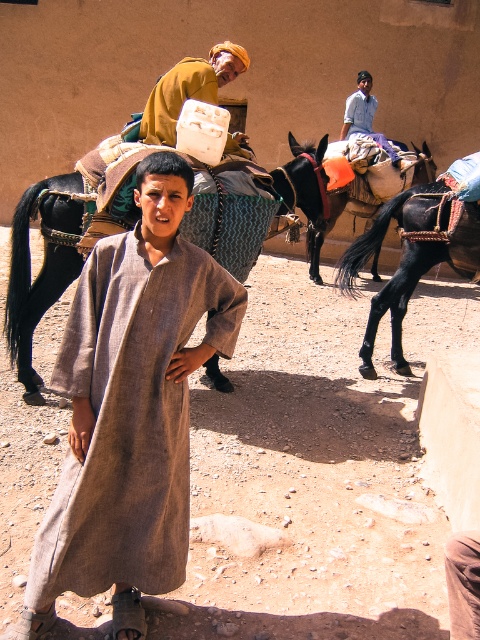
Question: Is light brown woolen robe at center further to the viewer compared to yellow fabric turban at upper center?

Choices:
 (A) yes
 (B) no

Answer: (B)

Question: Considering the real-world distances, which object is farthest from the light brown woolen robe at center?

Choices:
 (A) black leather saddle at right
 (B) yellow fabric turban at upper center
 (C) black leather horse at left

Answer: (A)

Question: Is light brown woolen robe at center smaller than black leather saddle at right?

Choices:
 (A) yes
 (B) no

Answer: (A)

Question: Among these points, which one is farthest from the camera?

Choices:
 (A) (22, 332)
 (B) (437, 216)

Answer: (B)

Question: Is black leather horse at left to the left of black leather saddle at right from the viewer's perspective?

Choices:
 (A) no
 (B) yes

Answer: (B)

Question: Which of the following is the closest to the observer?

Choices:
 (A) (212, 97)
 (B) (316, 280)
 (C) (348, 132)
 (D) (418, 209)

Answer: (A)